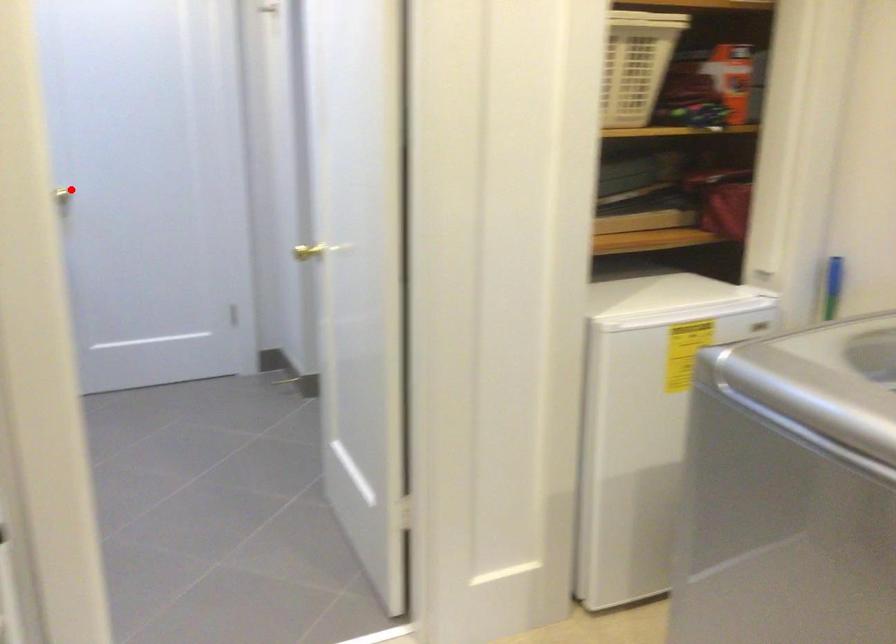
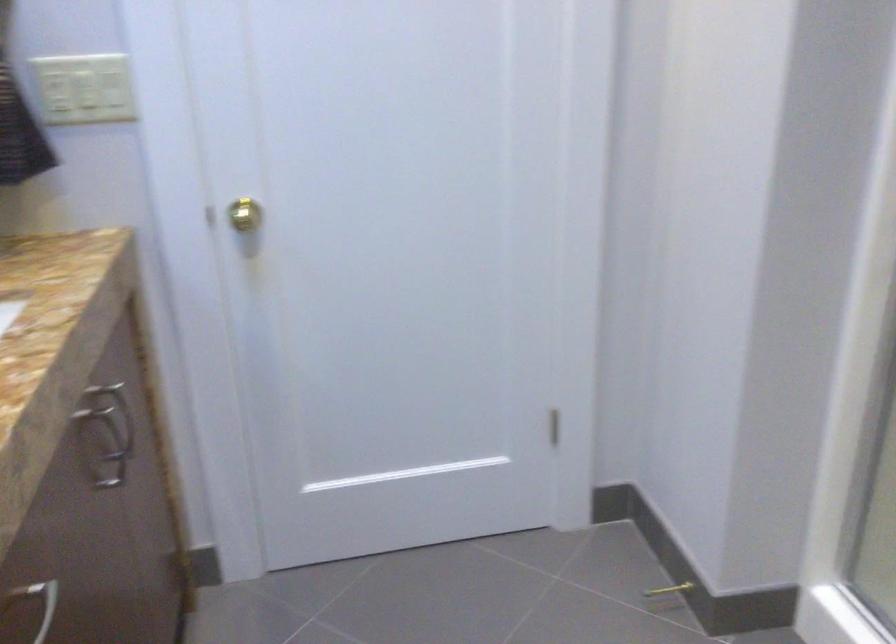
In the second image, find the point that corresponds to the highlighted location in the first image.

(240, 214)